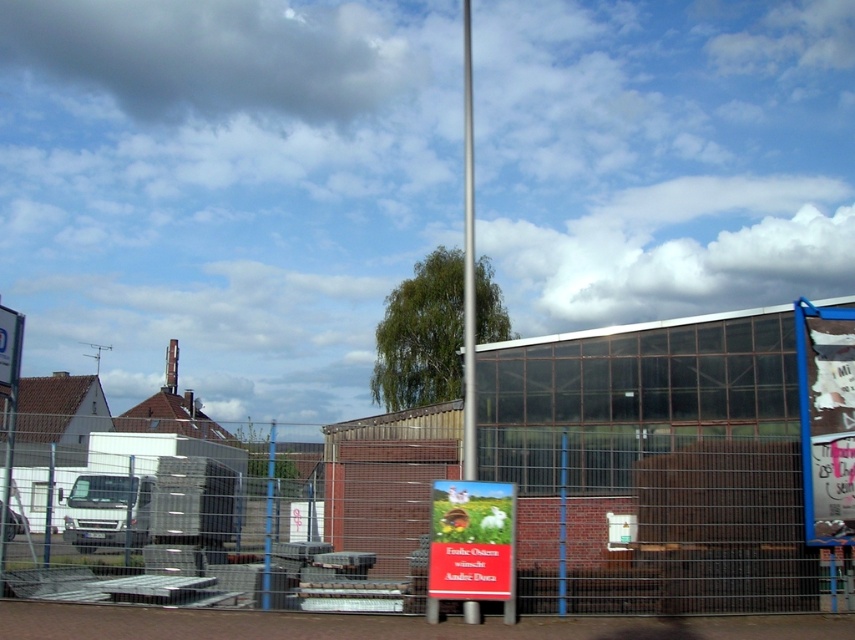
You are a delivery person trying to find the entrance to the facility. You see the white paper sign at center and the metallic flag pole at center. Which object is closer to the entrance if the entrance is located between them?

The entrance is located between the white paper sign at center and the metallic flag pole at center. Since they are 8.65 feet apart, the entrance is closer to whichever object is nearer to it. However, without additional information on their exact positions relative to the entrance, we cannot determine which is closer.

You are standing in the industrial area and see the white paper sign at center and the metallic pole at center. According to their positions, which one is located to the right side?

The white paper sign at center is located to the right of the metallic pole at center.

You are standing in the industrial area and want to determine the relative positions of two points marked in the scene. Which point, point (332, 460) or point (470, 148), is closer to you?

Point (332, 460) is closer to the viewer than point (470, 148).